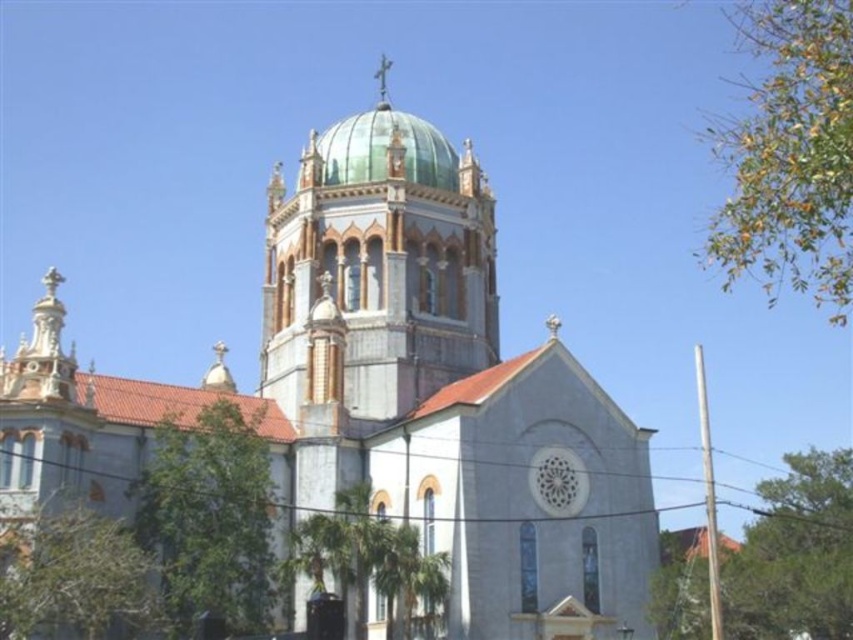
You are standing in front of the grand church building. There is a point marked at coordinates (x=386, y=406). Based on the scene description, can you determine which part of the church this point is located on?

The point at coordinates (x=386, y=406) is located on the white stone church at center.

You are an architect analyzing the church structure. You observe the green glass dome at center and the green glass dome at upper center. Which one has a greater height?

The green glass dome at center is much taller than the green glass dome at upper center according to the description.

You are standing in front of the church and want to know if the white stone church at center is wider than the green glass dome at center. Can you determine this based on the scene?

The white stone church at center is wider than the green glass dome at center according to the description.